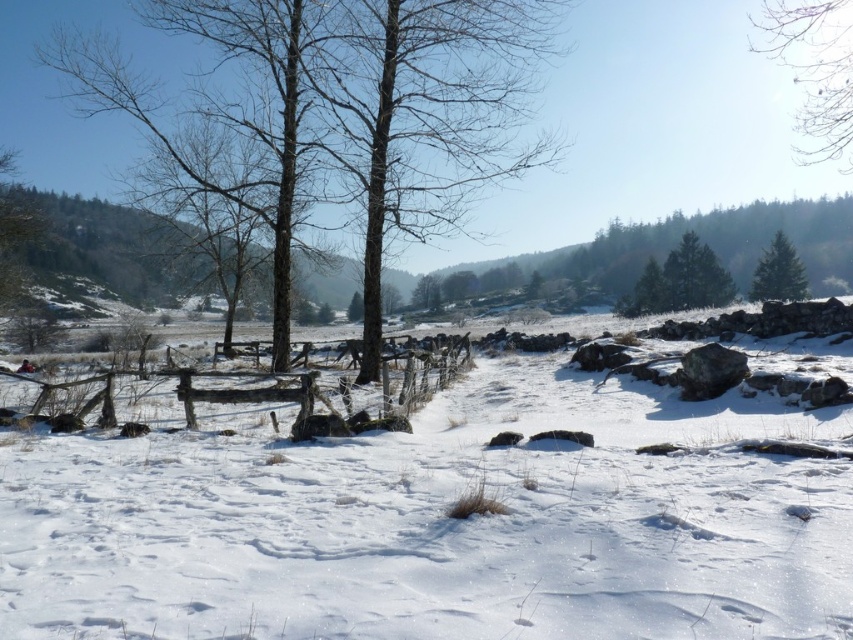
Question: Can you confirm if bare branches at upper right is positioned above green matte evergreen tree at upper right?

Choices:
 (A) no
 (B) yes

Answer: (B)

Question: Which point appears closest to the camera in this image?

Choices:
 (A) (772, 294)
 (B) (62, 593)
 (C) (804, 29)

Answer: (B)

Question: Does white fluffy snow at center have a larger size compared to green matte evergreen tree at upper right?

Choices:
 (A) no
 (B) yes

Answer: (A)

Question: Is white fluffy snow at center smaller than green matte trees at upper center?

Choices:
 (A) no
 (B) yes

Answer: (B)

Question: Which object is the closest to the white fluffy snow at center?

Choices:
 (A) green matte evergreen tree at upper right
 (B) bare branches at upper right

Answer: (B)

Question: Which point is farther to the camera?

Choices:
 (A) green matte evergreen tree at upper right
 (B) white fluffy snow at center
 (C) green matte trees at upper center
 (D) bare branches at upper right

Answer: (C)